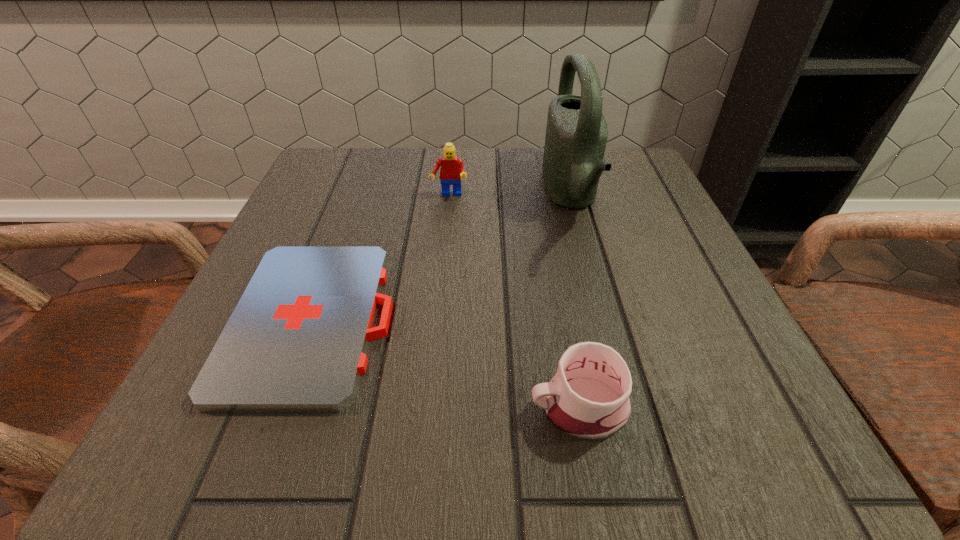
Locate an element on the screen. This screenshot has height=540, width=960. the tallest object is located at coordinates (576, 134).

This screenshot has width=960, height=540. What are the coordinates of `Lego` in the screenshot? It's located at click(x=452, y=171).

Identify the location of the second object from left to right. click(452, 171).

Image resolution: width=960 pixels, height=540 pixels. In order to click on mug in this screenshot , I will do [588, 398].

Identify the location of the leftmost object. The height and width of the screenshot is (540, 960). (296, 341).

Locate an element on the screen. The image size is (960, 540). the shortest object is located at coordinates (296, 341).

This screenshot has height=540, width=960. What are the coordinates of `vacant space positioned on the spout of the watering can` in the screenshot? It's located at (449, 194).

Where is `free spot located on the spout of the watering can`? This screenshot has width=960, height=540. free spot located on the spout of the watering can is located at coordinates (416, 194).

At what (x,y) coordinates should I click in order to perform the action: click on vacant space located on the spout of the watering can. Please return your answer as a coordinate pair (x, y). The image size is (960, 540). Looking at the image, I should click on (416, 194).

Find the location of a particular element. free space located on the front-facing side of the third object from right to left is located at coordinates (440, 294).